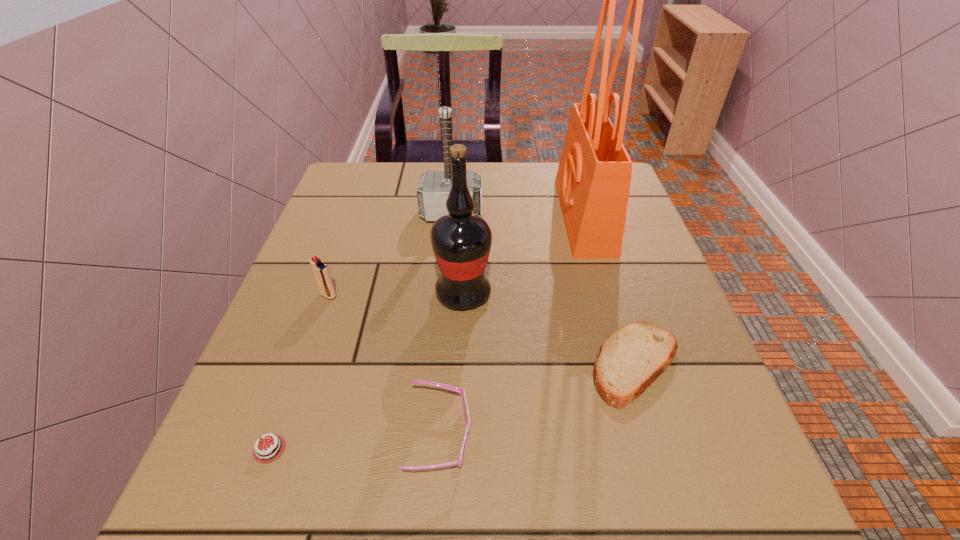
The width and height of the screenshot is (960, 540). In order to click on vacant position located on the right of the second tallest object in this screenshot , I will do tap(621, 294).

Where is `vacant space situated 0.240m for striking with the head of the third tallest object`? The width and height of the screenshot is (960, 540). vacant space situated 0.240m for striking with the head of the third tallest object is located at coordinates (444, 297).

Find the location of `free region located 0.260m on the right of the igniter`. free region located 0.260m on the right of the igniter is located at coordinates (467, 295).

Locate an element on the screen. The image size is (960, 540). free space located 0.150m on the front-facing side of the third shortest object is located at coordinates (570, 436).

Locate an element on the screen. This screenshot has height=540, width=960. vacant region located 0.120m on the front of the pita bread is located at coordinates (674, 487).

Find the location of a particular element. This screenshot has width=960, height=540. free space located on the right of the shortest object is located at coordinates (414, 449).

This screenshot has height=540, width=960. In order to click on tote bag at the far edge in this screenshot , I will do `click(593, 180)`.

Locate an element on the screen. This screenshot has width=960, height=540. hammer present at the far edge is located at coordinates [433, 188].

Where is `sunglasses positioned at the near edge`? The height and width of the screenshot is (540, 960). sunglasses positioned at the near edge is located at coordinates (x=466, y=415).

At what (x,y) coordinates should I click in order to perform the action: click on chocolate cake at the near edge. Please return your answer as a coordinate pair (x, y). Looking at the image, I should click on (269, 450).